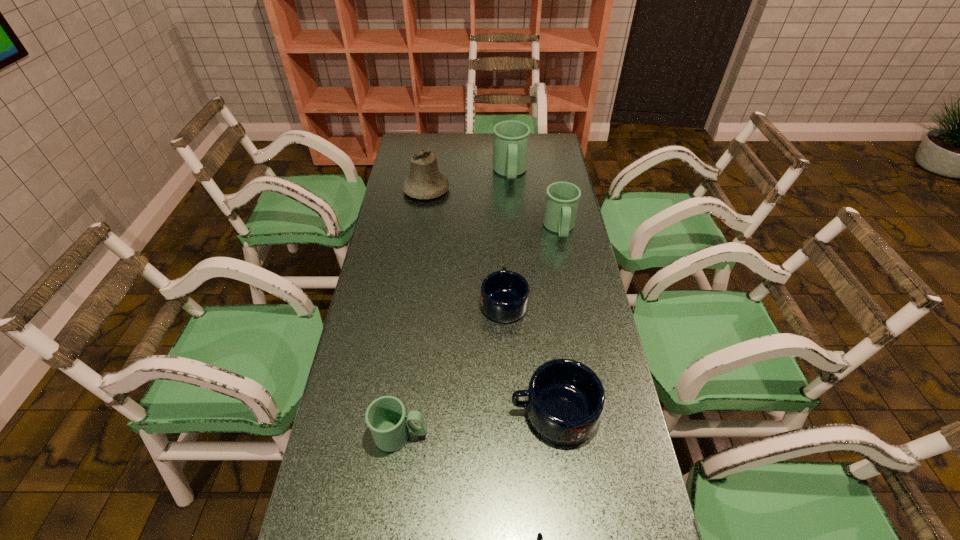
I want to click on object positioned at the far edge, so click(510, 149).

You are a GUI agent. You are given a task and a screenshot of the screen. Output one action in this format:
    pyautogui.click(x=<x>, y=<y>)
    Task: Click on the bell located in the left edge section of the desktop
    
    Given the screenshot: What is the action you would take?
    pyautogui.click(x=425, y=181)

Where is `mug at the left edge`? Image resolution: width=960 pixels, height=540 pixels. mug at the left edge is located at coordinates (385, 416).

Where is `free point at the far edge`? This screenshot has height=540, width=960. free point at the far edge is located at coordinates (465, 158).

The width and height of the screenshot is (960, 540). In the image, there is a desktop. What are the coordinates of `blank space at the left edge` in the screenshot? It's located at (368, 286).

Where is `free space at the right edge of the desktop`? free space at the right edge of the desktop is located at coordinates (588, 527).

You are a GUI agent. You are given a task and a screenshot of the screen. Output one action in this format:
    pyautogui.click(x=<x>, y=<y>)
    Task: Click on the unoccupied position between the biggest blue mug and the nearest green mug
    Image resolution: width=960 pixels, height=540 pixels.
    Given the screenshot: What is the action you would take?
    pyautogui.click(x=477, y=423)

Find the location of a particular element. Image resolution: width=960 pixels, height=540 pixels. blank region between the bell and the second farthest green mug is located at coordinates (492, 210).

At what (x,y) coordinates should I click in order to perform the action: click on unoccupied area between the second farthest blue mug and the smallest green mug. Please return your answer as a coordinate pair (x, y). Looking at the image, I should click on (477, 423).

Where is `free area in between the third farthest object and the bell`? This screenshot has height=540, width=960. free area in between the third farthest object and the bell is located at coordinates (492, 210).